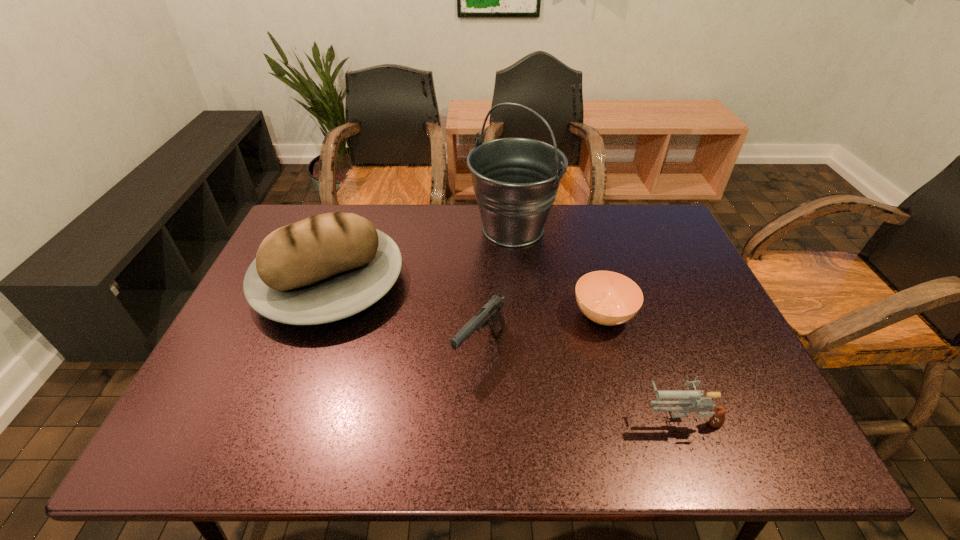
Locate an element on the screen. The height and width of the screenshot is (540, 960). the tallest object is located at coordinates (515, 180).

Identify the location of the fourth shortest object. The image size is (960, 540). (327, 267).

The height and width of the screenshot is (540, 960). Identify the location of bread. (327, 267).

The image size is (960, 540). I want to click on the farther gun, so click(490, 314).

You are a GUI agent. You are given a task and a screenshot of the screen. Output one action in this format:
    pyautogui.click(x=<x>, y=<y>)
    Task: Click on the right gun
    The width and height of the screenshot is (960, 540).
    Given the screenshot: What is the action you would take?
    pyautogui.click(x=686, y=398)

At what (x,y) coordinates should I click in order to perform the action: click on the nearest object. Please return your answer as a coordinate pair (x, y). This screenshot has height=540, width=960. Looking at the image, I should click on (686, 398).

You are a GUI agent. You are given a task and a screenshot of the screen. Output one action in this format:
    pyautogui.click(x=<x>, y=<y>)
    Task: Click on the shortest object
    The image size is (960, 540).
    Given the screenshot: What is the action you would take?
    pyautogui.click(x=607, y=298)

Where is `vacant space positioned on the right of the tallest object`? The height and width of the screenshot is (540, 960). vacant space positioned on the right of the tallest object is located at coordinates (639, 229).

Locate an element on the screen. free space located on the front of the bread is located at coordinates [x=273, y=435].

Identify the location of vacant space located at the muzzle of the farther gun. Image resolution: width=960 pixels, height=540 pixels. (480, 400).